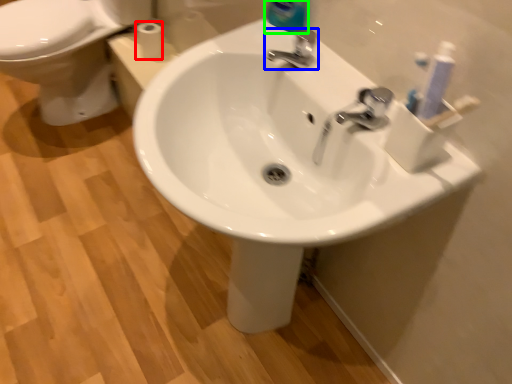
Question: Considering the real-world distances, which object is farthest from toilet paper (highlighted by a red box)? tap (highlighted by a blue box) or cleaning product (highlighted by a green box)?

Choices:
 (A) tap
 (B) cleaning product

Answer: (A)